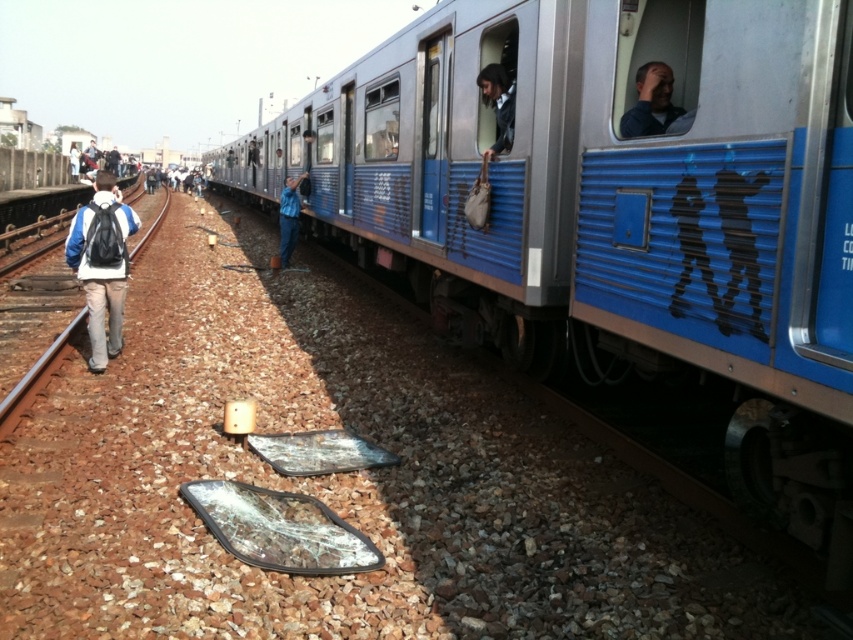
What are the coordinates of the blue fabric shirt at upper center?

The blue fabric shirt at upper center is located at point [651,102].

You are a maintenance worker at the station. You need to inspect the brown gravel train track at left and the metallic blue train at center. Which object should you check first if you start from the station entrance located at the far left end of the track?

You should check the brown gravel train track at left first because it is closer to the station entrance at the far left end of the track compared to the metallic blue train at center, which is positioned further to the right side of the track.

You are a maintenance worker at the station and need to reach both the point at (x=659, y=90) and the other point. How far apart are these two points?

The two points are 3.60 meters apart.